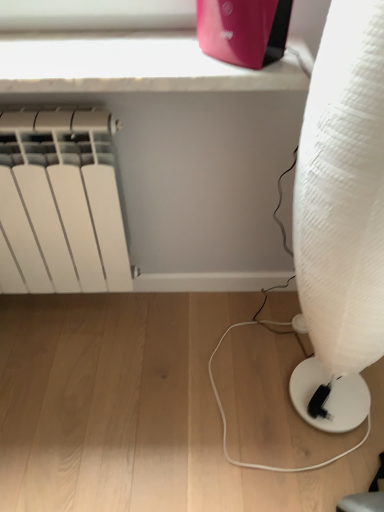
Question: From the image's perspective, does matte pink router at upper center appear higher than white matte radiator at left?

Choices:
 (A) no
 (B) yes

Answer: (B)

Question: Considering the relative sizes of matte pink router at upper center and white matte radiator at left in the image provided, is matte pink router at upper center smaller than white matte radiator at left?

Choices:
 (A) yes
 (B) no

Answer: (A)

Question: Does matte pink router at upper center come behind white matte radiator at left?

Choices:
 (A) no
 (B) yes

Answer: (A)

Question: Considering the relative sizes of matte pink router at upper center and white matte radiator at left in the image provided, is matte pink router at upper center bigger than white matte radiator at left?

Choices:
 (A) no
 (B) yes

Answer: (A)

Question: Is matte pink router at upper center beside white matte radiator at left?

Choices:
 (A) yes
 (B) no

Answer: (B)

Question: Relative to matte pink router at upper center, is white matte radiator at left in front or behind?

Choices:
 (A) front
 (B) behind

Answer: (B)

Question: Considering the positions of point [x=31, y=203] and point [x=230, y=50], is point [x=31, y=203] closer or farther from the camera than point [x=230, y=50]?

Choices:
 (A) closer
 (B) farther

Answer: (B)

Question: Is white matte radiator at left taller or shorter than matte pink router at upper center?

Choices:
 (A) tall
 (B) short

Answer: (A)

Question: Is white matte radiator at left situated inside matte pink router at upper center or outside?

Choices:
 (A) outside
 (B) inside

Answer: (A)

Question: From a real-world perspective, is white textured lamp at right physically located above or below white matte radiator at left?

Choices:
 (A) below
 (B) above

Answer: (B)

Question: Considering the positions of white textured lamp at right and white matte radiator at left in the image, is white textured lamp at right taller or shorter than white matte radiator at left?

Choices:
 (A) tall
 (B) short

Answer: (A)

Question: Considering the positions of point (307, 374) and point (102, 251), is point (307, 374) closer or farther from the camera than point (102, 251)?

Choices:
 (A) farther
 (B) closer

Answer: (B)

Question: Considering the relative positions of white textured lamp at right and white matte radiator at left in the image provided, is white textured lamp at right to the left or to the right of white matte radiator at left?

Choices:
 (A) left
 (B) right

Answer: (B)

Question: Looking at the image, does white textured lamp at right seem bigger or smaller compared to matte pink router at upper center?

Choices:
 (A) small
 (B) big

Answer: (B)

Question: From the image's perspective, is white textured lamp at right positioned above or below matte pink router at upper center?

Choices:
 (A) above
 (B) below

Answer: (B)